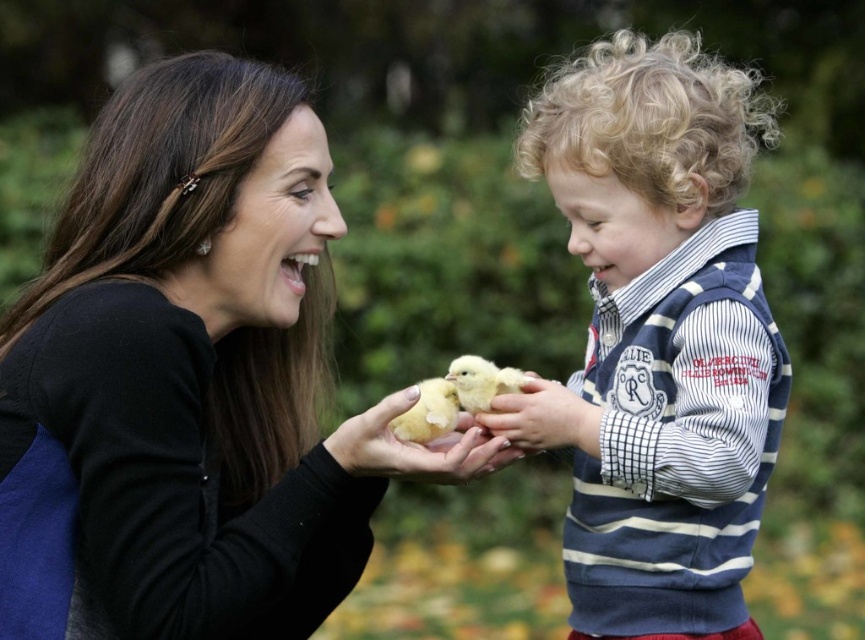
You are a photographer trying to capture a clear shot of both the soft yellow chick at center and the fluffy yellow chick at center. Since you want to focus on the smaller one, which chick should you adjust your camera to focus on?

The fluffy yellow chick at center is smaller, so you should adjust your camera to focus on it.

You are a photographer trying to capture a closeup of both the matte black sweater at center and the fluffy yellow chick at center. Given that your camera can only focus on objects within a 10cm width, will you need to adjust your camera settings to accommodate both?

The matte black sweater at center is wider than the fluffy yellow chick at center. Since the camera can focus on objects within a 10cm width, you need to check the actual width of both objects to ensure they fit within the focus range. However, the description only provides a comparison of their widths, not exact measurements. Without specific dimensions, it is uncertain if they will fit within the 10cm limit.